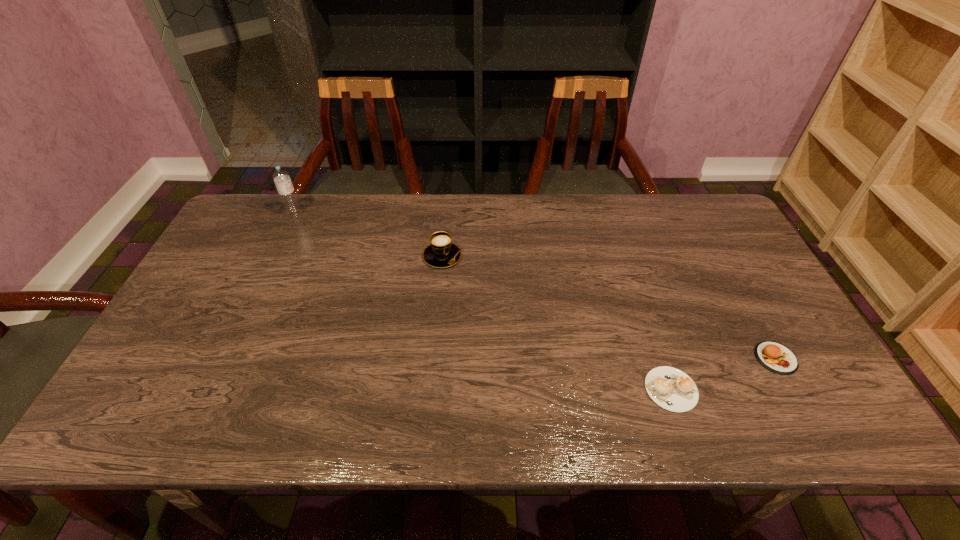
The width and height of the screenshot is (960, 540). What are the coordinates of `vacant area located on the left of the patty (food)` in the screenshot? It's located at (682, 358).

Locate an element on the screen. free region located on the left of the shortest object is located at coordinates (571, 389).

Where is `object present at the far edge`? The width and height of the screenshot is (960, 540). object present at the far edge is located at coordinates (286, 191).

Locate an element on the screen. This screenshot has width=960, height=540. object that is at the near edge is located at coordinates (670, 388).

This screenshot has height=540, width=960. In order to click on object at the left edge in this screenshot , I will do `click(286, 191)`.

At what (x,y) coordinates should I click in order to perform the action: click on object that is at the right edge. Please return your answer as a coordinate pair (x, y). The image size is (960, 540). Looking at the image, I should click on (777, 358).

Locate an element on the screen. The width and height of the screenshot is (960, 540). object that is at the far left corner is located at coordinates (286, 191).

At what (x,y) coordinates should I click in order to perform the action: click on free spot at the far edge of the desktop. Please return your answer as a coordinate pair (x, y). The height and width of the screenshot is (540, 960). Looking at the image, I should click on (329, 224).

Locate an element on the screen. Image resolution: width=960 pixels, height=540 pixels. free region at the near edge of the desktop is located at coordinates (292, 407).

Locate an element on the screen. vacant space at the left edge of the desktop is located at coordinates (207, 270).